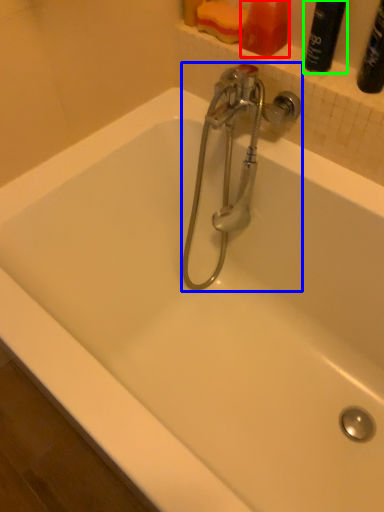
Question: Which is nearer to the toiletry (highlighted by a red box)? tap (highlighted by a blue box) or cleaning product (highlighted by a green box).

Choices:
 (A) tap
 (B) cleaning product

Answer: (B)